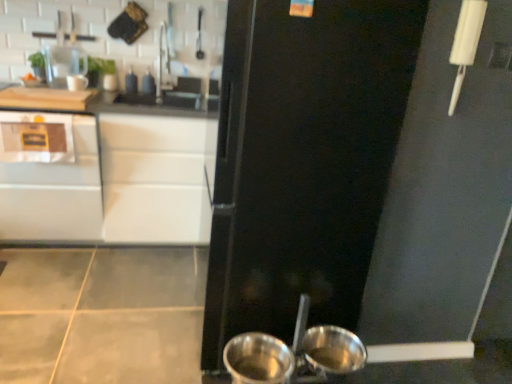
You are a GUI agent. You are given a task and a screenshot of the screen. Output one action in this format:
    pyautogui.click(x=<x>, y=<y>)
    Task: Click on the shiny metallic pot at lower center
    
    Given the screenshot: What is the action you would take?
    pyautogui.click(x=258, y=359)

What do you see at coordinates (258, 359) in the screenshot? Image resolution: width=512 pixels, height=384 pixels. I see `shiny metallic pot at lower center` at bounding box center [258, 359].

This screenshot has width=512, height=384. What do you see at coordinates (102, 177) in the screenshot?
I see `white glossy cabinet at upper left` at bounding box center [102, 177].

At what (x,y) coordinates should I click in order to perform the action: click on brushed metal faucet at upper center. Please return your answer as a coordinate pair (x, y). This screenshot has height=384, width=512. Looking at the image, I should click on (162, 63).

Find the location of a particular element. satin white cabinet at left is located at coordinates (50, 177).

In order to click on metallic silver basin at lower center in this screenshot , I will do `click(332, 350)`.

Does shiny metallic pot at lower center have a smaller size compared to brushed metal faucet at upper center?

Yes.

From the image's perspective, between shiny metallic pot at lower center and brushed metal faucet at upper center, which one is located above?

brushed metal faucet at upper center, from the image's perspective.

Which is more to the right, shiny metallic pot at lower center or brushed metal faucet at upper center?

From the viewer's perspective, shiny metallic pot at lower center appears more on the right side.

Is point (233, 344) farther from camera compared to point (159, 39)?

No, (233, 344) is in front of (159, 39).

Locate an element on the screen. This screenshot has width=512, height=384. faucet on the left of the black matte refrigerator at center is located at coordinates (162, 63).

Is black matte refrigerator at center not close to brushed metal faucet at upper center?

Yes, black matte refrigerator at center and brushed metal faucet at upper center are located far from each other.

Is black matte refrigerator at center thinner than brushed metal faucet at upper center?

In fact, black matte refrigerator at center might be wider than brushed metal faucet at upper center.

From the image's perspective, which is above, black matte refrigerator at center or brushed metal faucet at upper center?

From the image's view, brushed metal faucet at upper center is above.

Is shiny metallic pot at lower center shorter than satin white cabinet at left?

Correct, shiny metallic pot at lower center is not as tall as satin white cabinet at left.

From the image's perspective, between shiny metallic pot at lower center and satin white cabinet at left, who is located below?

shiny metallic pot at lower center, from the image's perspective.

Where is `kitchen appliance below the satin white cabinet at left (from the image's perspective)`? kitchen appliance below the satin white cabinet at left (from the image's perspective) is located at coordinates (258, 359).

Is the depth of white glossy cabinet at upper left less than that of satin white cabinet at left?

That is False.

Which object is positioned more to the right, white glossy cabinet at upper left or satin white cabinet at left?

From the viewer's perspective, white glossy cabinet at upper left appears more on the right side.

Considering the relative sizes of white glossy cabinet at upper left and satin white cabinet at left in the image provided, is white glossy cabinet at upper left wider than satin white cabinet at left?

In fact, white glossy cabinet at upper left might be narrower than satin white cabinet at left.

Which is less distant, (135, 123) or (42, 157)?

The point (42, 157) is in front.

Is the surface of brushed metal faucet at upper center in direct contact with satin white cabinet at left?

They are not placed beside each other.

Between brushed metal faucet at upper center and satin white cabinet at left, which one appears on the right side from the viewer's perspective?

brushed metal faucet at upper center.

Can you confirm if brushed metal faucet at upper center is wider than satin white cabinet at left?

In fact, brushed metal faucet at upper center might be narrower than satin white cabinet at left.

Which object is wider, black matte refrigerator at center or white glossy cabinet at upper left?

With larger width is black matte refrigerator at center.

Is black matte refrigerator at center to the right of white glossy cabinet at upper left from the viewer's perspective?

Correct, you'll find black matte refrigerator at center to the right of white glossy cabinet at upper left.

Which is nearer, (234, 73) or (148, 168)?

The point (234, 73) is closer.

Considering the relative sizes of black matte refrigerator at center and white glossy cabinet at upper left in the image provided, is black matte refrigerator at center bigger than white glossy cabinet at upper left?

Actually, black matte refrigerator at center might be smaller than white glossy cabinet at upper left.

From a real-world perspective, is satin white cabinet at left over white glossy cabinet at upper left?

Actually, satin white cabinet at left is physically below white glossy cabinet at upper left in the real world.

Is the position of satin white cabinet at left more distant than that of white glossy cabinet at upper left?

No, it is in front of white glossy cabinet at upper left.

Which is nearer, [21,222] or [49,126]?

Clearly, point [21,222] is more distant from the camera than point [49,126].

Is satin white cabinet at left to the left or to the right of white glossy cabinet at upper left in the image?

satin white cabinet at left is positioned on white glossy cabinet at upper left's left side.

At what (x,y) coordinates should I click in order to perform the action: click on faucet that appears above the shiny metallic pot at lower center (from the image's perspective). Please return your answer as a coordinate pair (x, y). The height and width of the screenshot is (384, 512). Looking at the image, I should click on (162, 63).

You are a GUI agent. You are given a task and a screenshot of the screen. Output one action in this format:
    pyautogui.click(x=<x>, y=<y>)
    Task: Click on the door below the brushed metal faucet at upper center (from a real-world perspective)
    This screenshot has height=384, width=512.
    Given the screenshot: What is the action you would take?
    pyautogui.click(x=303, y=160)

Considering their positions, is black matte refrigerator at center positioned further to satin white cabinet at left than white glossy cabinet at upper left?

The object further to satin white cabinet at left is black matte refrigerator at center.

Which object lies nearer to the anchor point white glossy cabinet at upper left, black matte refrigerator at center or metallic silver basin at lower center?

Among the two, black matte refrigerator at center is located nearer to white glossy cabinet at upper left.

Based on their spatial positions, is black matte refrigerator at center or brushed metal faucet at upper center closer to metallic silver basin at lower center?

black matte refrigerator at center lies closer to metallic silver basin at lower center than the other object.

Considering their positions, is white glossy cabinet at upper left positioned further to satin white cabinet at left than brushed metal faucet at upper center?

brushed metal faucet at upper center lies further to satin white cabinet at left than the other object.

Looking at the image, which one is located further to satin white cabinet at left, metallic silver basin at lower center or black matte refrigerator at center?

Among the two, metallic silver basin at lower center is located further to satin white cabinet at left.

Looking at the image, which one is located closer to white glossy cabinet at upper left, brushed metal faucet at upper center or metallic silver basin at lower center?

brushed metal faucet at upper center is positioned closer to the anchor white glossy cabinet at upper left.

Looking at the image, which one is located further to metallic silver basin at lower center, satin white cabinet at left or shiny metallic pot at lower center?

The object further to metallic silver basin at lower center is satin white cabinet at left.

Looking at this image, based on their spatial positions, is satin white cabinet at left or metallic silver basin at lower center closer to black matte refrigerator at center?

metallic silver basin at lower center lies closer to black matte refrigerator at center than the other object.

Locate an element on the screen. door between brushed metal faucet at upper center and shiny metallic pot at lower center in the up-down direction is located at coordinates (303, 160).

Where is `kitchen appliance between black matte refrigerator at center and metallic silver basin at lower center in the vertical direction`? kitchen appliance between black matte refrigerator at center and metallic silver basin at lower center in the vertical direction is located at coordinates (258, 359).

Find the location of a particular element. Image resolution: width=512 pixels, height=384 pixels. door situated between white glossy cabinet at upper left and metallic silver basin at lower center from left to right is located at coordinates (303, 160).

At what (x,y) coordinates should I click in order to perform the action: click on kitchen appliance between satin white cabinet at left and metallic silver basin at lower center from left to right. Please return your answer as a coordinate pair (x, y). The width and height of the screenshot is (512, 384). Looking at the image, I should click on (258, 359).